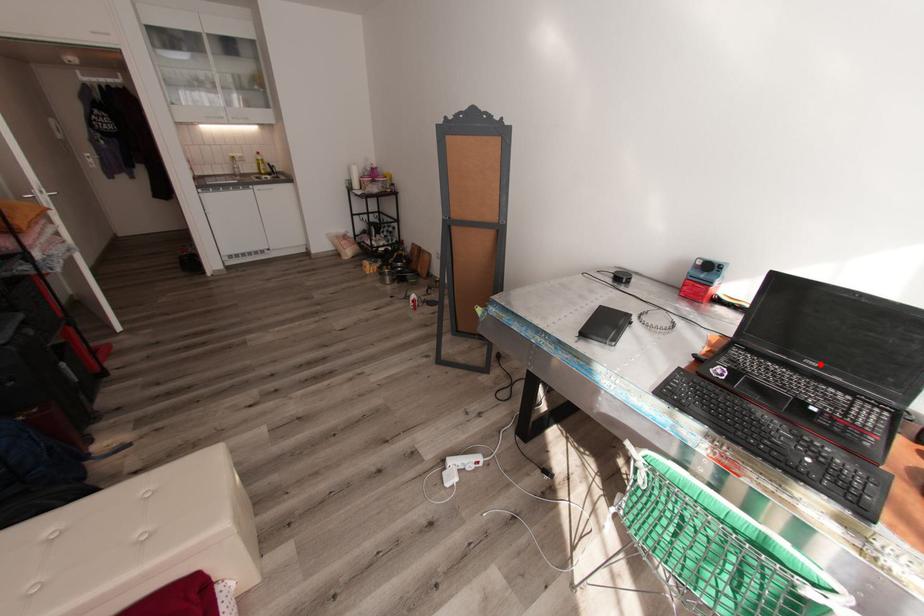
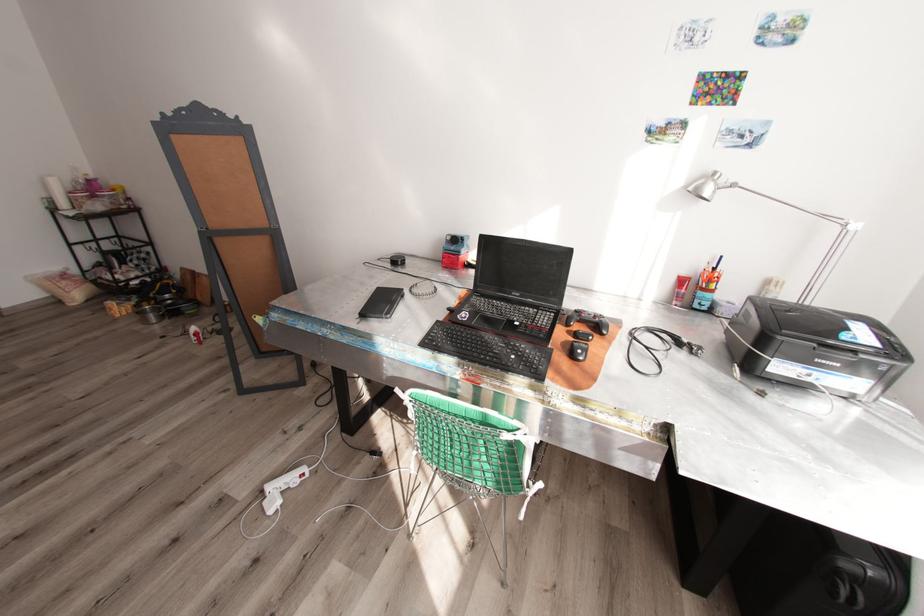
Find the pixel in the second image that matches the highlighted location in the first image.

(523, 294)